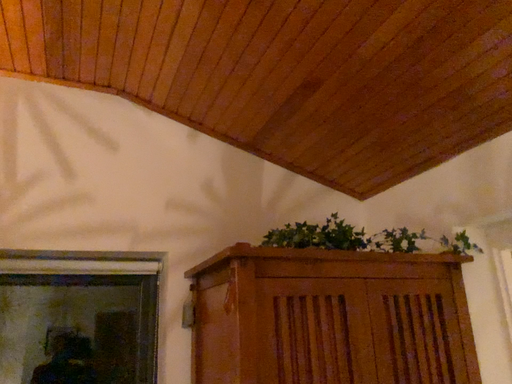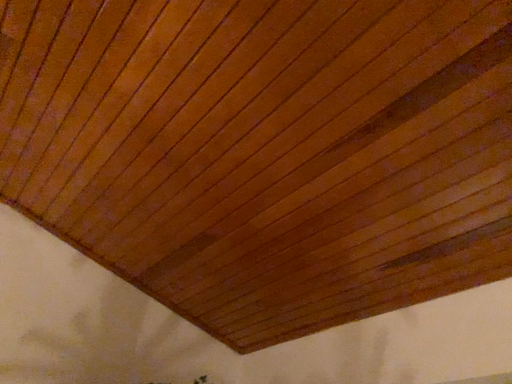
Question: Which way did the camera rotate in the video?

Choices:
 (A) rotated right
 (B) rotated left

Answer: (A)